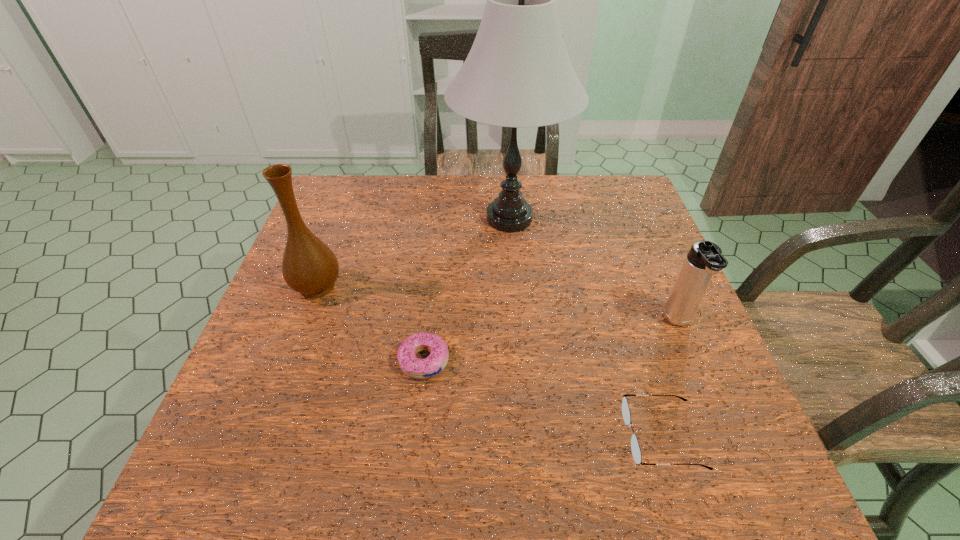
Find the location of a particular element. Image resolution: width=960 pixels, height=540 pixels. object that can be found as the closest to the second nearest object is located at coordinates (309, 267).

Locate an element on the screen. The height and width of the screenshot is (540, 960). vacant space that satisfies the following two spatial constraints: 1. on the back side of the farthest object; 2. on the left side of the second nearest object is located at coordinates (440, 219).